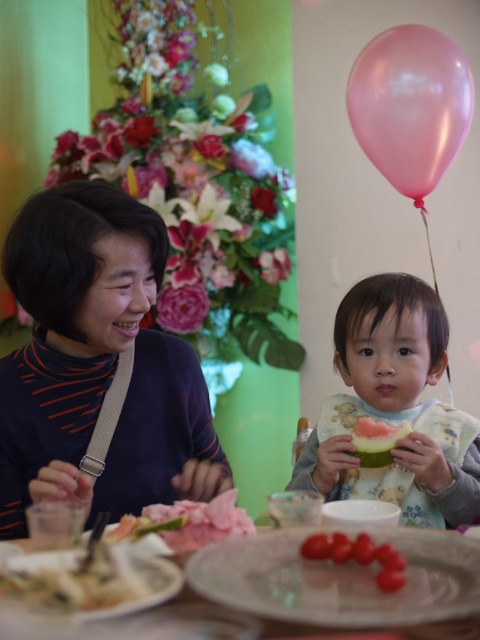
You are a photographer standing at the center of the room. You want to take a photo of the pink glossy balloon at upper right and the adult with short dark hair on the left. How far apart are these two subjects in feet?

The pink glossy balloon at upper right and the adult with short dark hair on the left are 5.98 feet apart.

You are a guest at the gathering and want to place a small napkin on the table. The napkin needs to be placed between the white glossy plate at lower center and the green matte watermelon at lower right. Which object should you position the napkin closer to if you want it to be nearer to the taller object?

The green matte watermelon at lower right is taller than the white glossy plate at lower center. Therefore, to place the napkin closer to the taller object, position it nearer to the green matte watermelon at lower right.

You are a guest at the gathering and want to reach for the green matte watermelon at lower right without touching the pink glossy balloon at upper right. Is this possible?

Yes, because the pink glossy balloon at upper right is closer to you than the green matte watermelon at lower right, so you can reach the watermelon without disturbing the balloon.